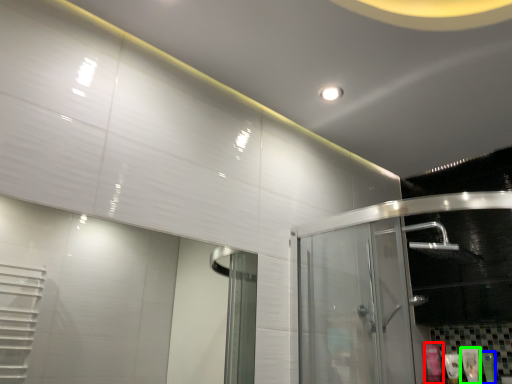
Question: Which object is the closest to the toiletry (highlighted by a red box)? Choose among these: toiletry (highlighted by a blue box) or toiletry (highlighted by a green box).

Choices:
 (A) toiletry
 (B) toiletry

Answer: (B)